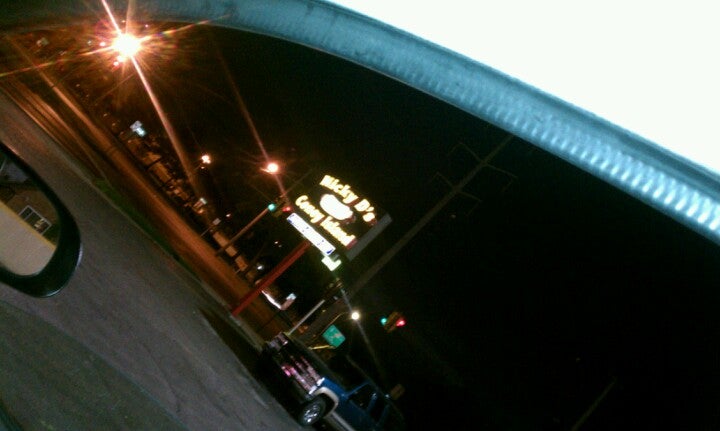
This screenshot has width=720, height=431. What are the coordinates of `green light` in the screenshot? It's located at (382, 320).